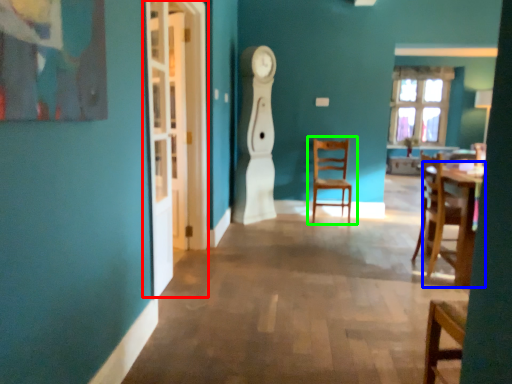
Question: Based on their relative distances, which object is farther from glass door (highlighted by a red box)? Choose from table (highlighted by a blue box) and chair (highlighted by a green box).

Choices:
 (A) table
 (B) chair

Answer: (B)